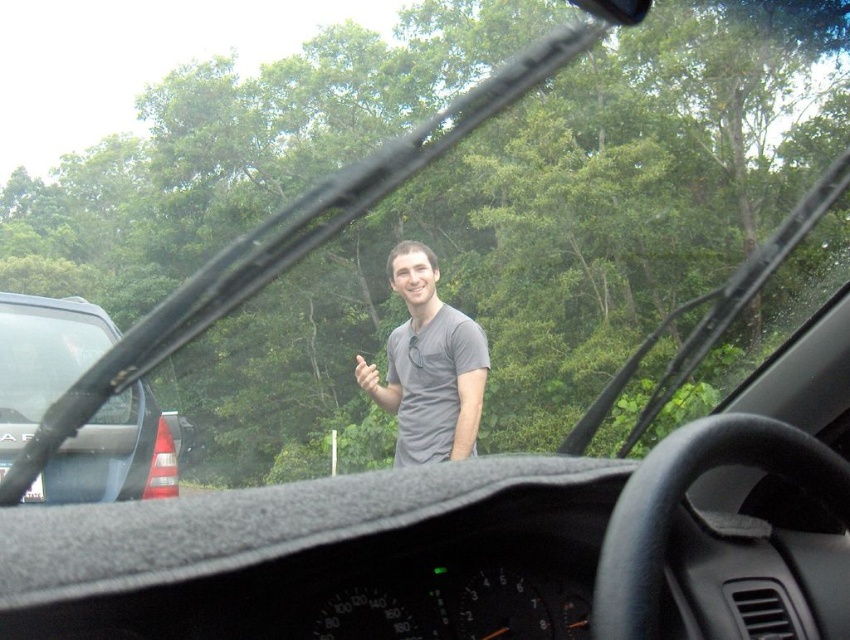
You are driving a car and see the image through the windshield. There is a point marked at coordinates (431, 365) on the windshield. What object is located at that point?

The point at coordinates (431, 365) on the windshield indicates the gray matte shirt at center.

You are inside a car looking out through the windshield. You see a point marked at coordinates (42,358). What object is located at that point?

The point at coordinates (42,358) marks the satin black car at left.

You are a passenger in the car and want to wave back to the person outside. However, you notice that the matte gray hand at center and the satin black car at left are positioned in a way that might block your view. Can you see the person outside clearly through the windshield?

The matte gray hand at center is behind the satin black car at left, so the hand is closer to you than the car. This means the hand is blocking your view of the person outside, making it difficult to see them clearly.